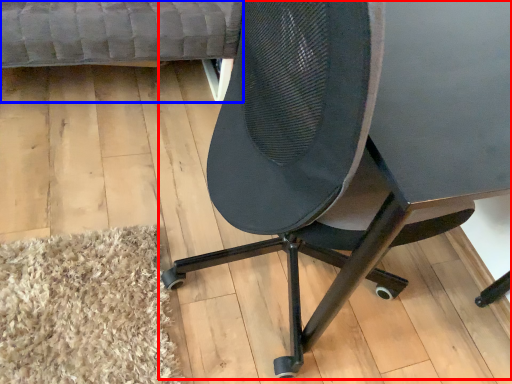
Question: Which object is closer to the camera taking this photo, chair (highlighted by a red box) or couch (highlighted by a blue box)?

Choices:
 (A) chair
 (B) couch

Answer: (A)